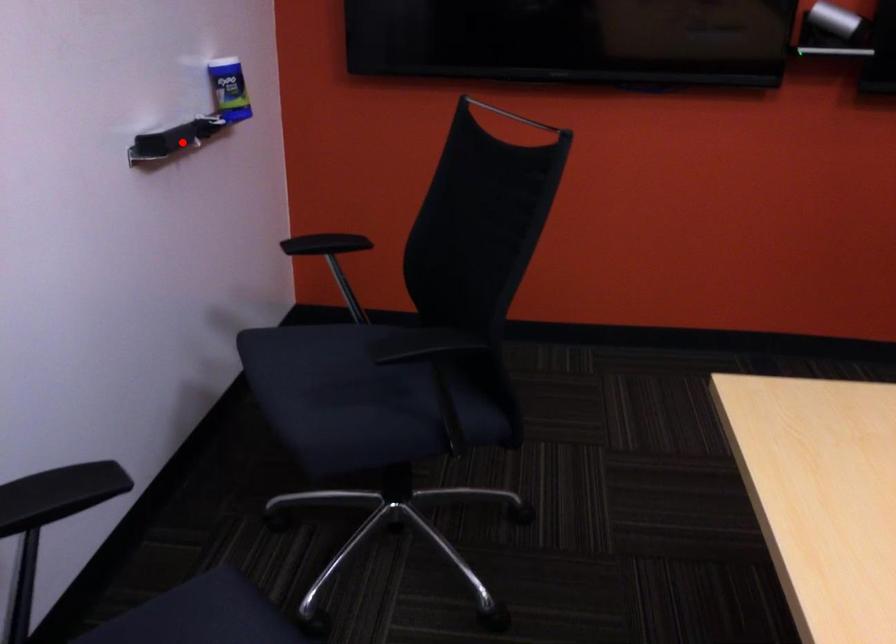
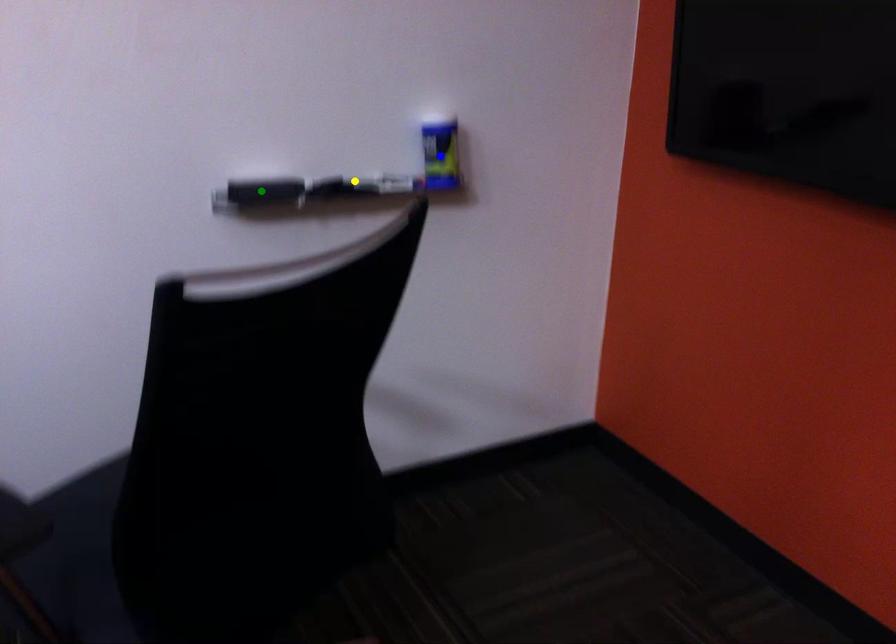
Question: I am providing you with two images of the same scene from different viewpoints. A red point is marked on the first image. You are given multiple points on the second image. In image 2, which mark is for the same physical point as the one in image 1?

Choices:
 (A) blue point
 (B) green point
 (C) yellow point

Answer: (B)